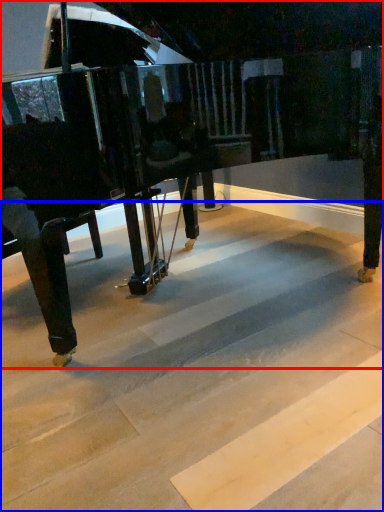
Question: Among these objects, which one is farthest to the camera, piano (highlighted by a red box) or stair (highlighted by a blue box)?

Choices:
 (A) piano
 (B) stair

Answer: (A)